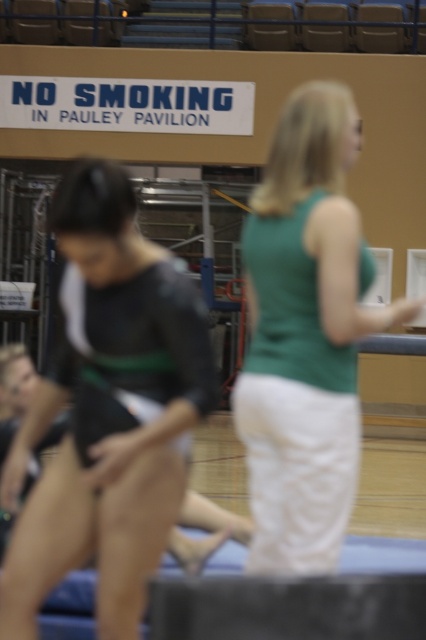
Question: Is black leotard at left to the left of green fabric tank top at center from the viewer's perspective?

Choices:
 (A) yes
 (B) no

Answer: (A)

Question: Does black leotard at left come behind green fabric tank top at center?

Choices:
 (A) no
 (B) yes

Answer: (A)

Question: Which point is closer to the camera taking this photo?

Choices:
 (A) (299, 525)
 (B) (14, 548)

Answer: (B)

Question: Is black leotard at left thinner than green fabric tank top at center?

Choices:
 (A) yes
 (B) no

Answer: (B)

Question: Which object appears closest to the camera in this image?

Choices:
 (A) green fabric tank top at center
 (B) black leotard at left

Answer: (B)

Question: Among these objects, which one is farthest from the camera?

Choices:
 (A) black leotard at left
 (B) green fabric tank top at center

Answer: (B)